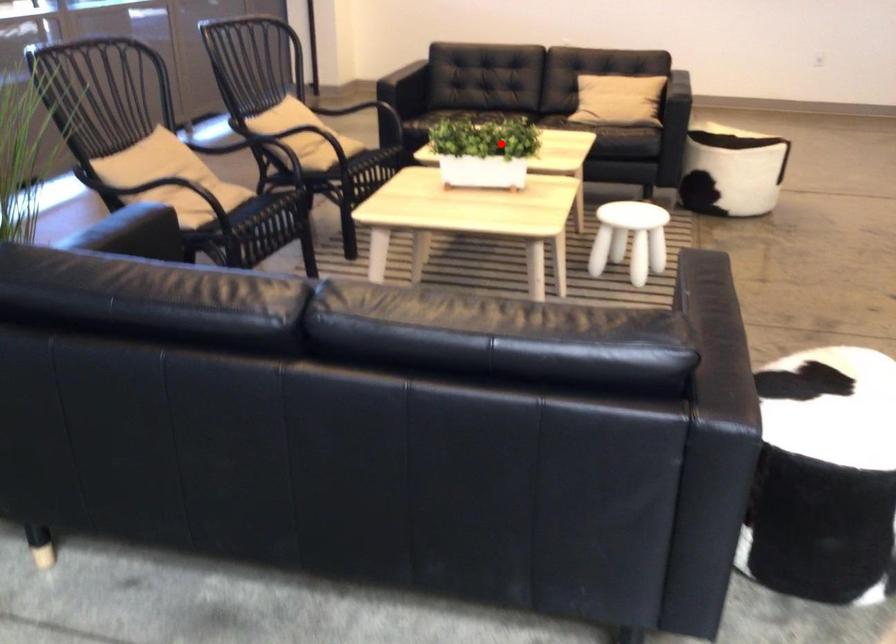
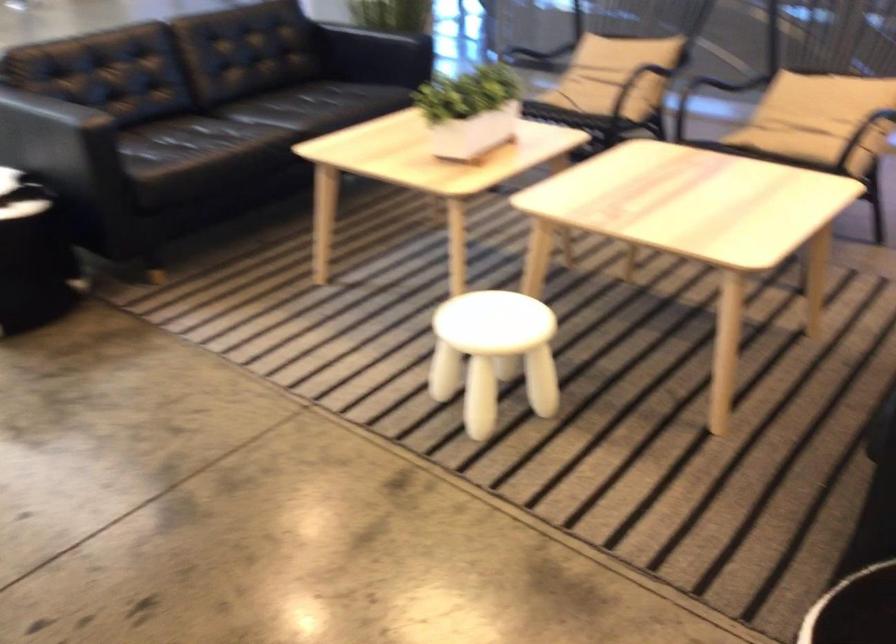
Locate, in the second image, the point that corresponds to the highlighted location in the first image.

(470, 111)